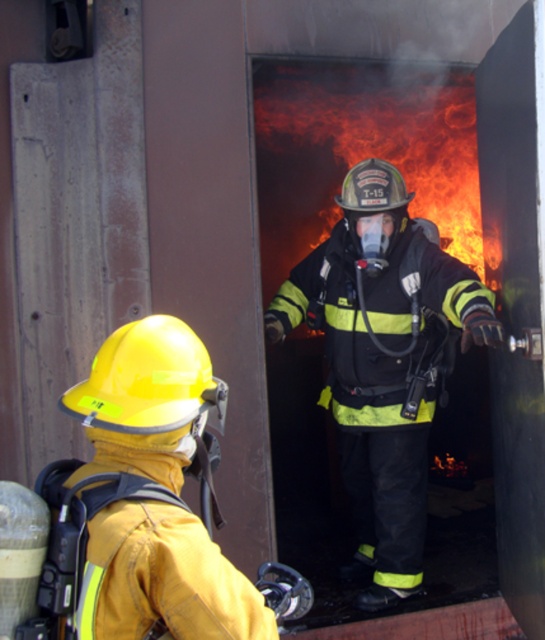
You are a safety inspector assessing the scene. You notice the black matte fireman at center and the yellow matte helmet at left. Which object is taller?

The black matte fireman at center is much taller than the yellow matte helmet at left.

You are a firefighter in the scene. You need to retrieve your equipment from the yellow matte helmet at left, but you are currently standing next to the black matte fireman at center. Which direction should you move to reach the helmet?

The yellow matte helmet at left is located to the left of the black matte fireman at center. Since you are standing next to the black matte fireman at center, you should move to your left to reach the yellow matte helmet at left.